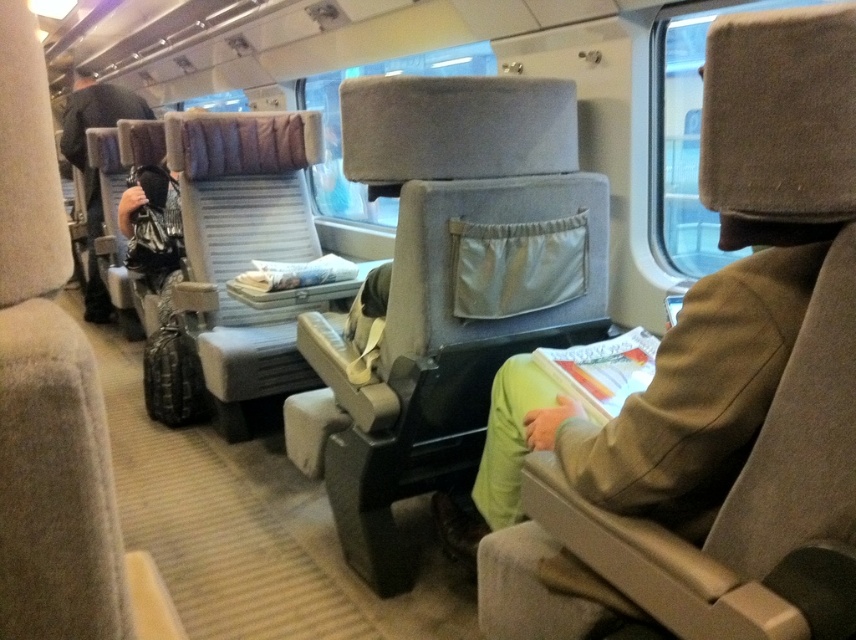
You are a passenger trying to store your 18 inch tall backpack. You see the matte gray seat at center and the matte black backpack at left. Which one has enough vertical space for your backpack?

The matte black backpack at left is taller than the matte gray seat at center, so it has enough vertical space for your 18 inch tall backpack.

Looking at this image, you are a passenger on the train and want to place your matte black backpack at left on the floor near the gray fabric chair at center. Can you confirm if the backpack will be to the right or left of the chair when placed there?

The gray fabric chair at center is positioned on the right side of matte black backpack at left, so when placing the backpack on the floor near the chair, the backpack will be to the left of the gray fabric chair at center.

You are a traveler trying to find space to place your new backpack. You see a matte gray seat at center and a matte black backpack at left. Which object takes up more space in the scene?

The matte black backpack at left occupies more space than the matte gray seat at center according to the description.